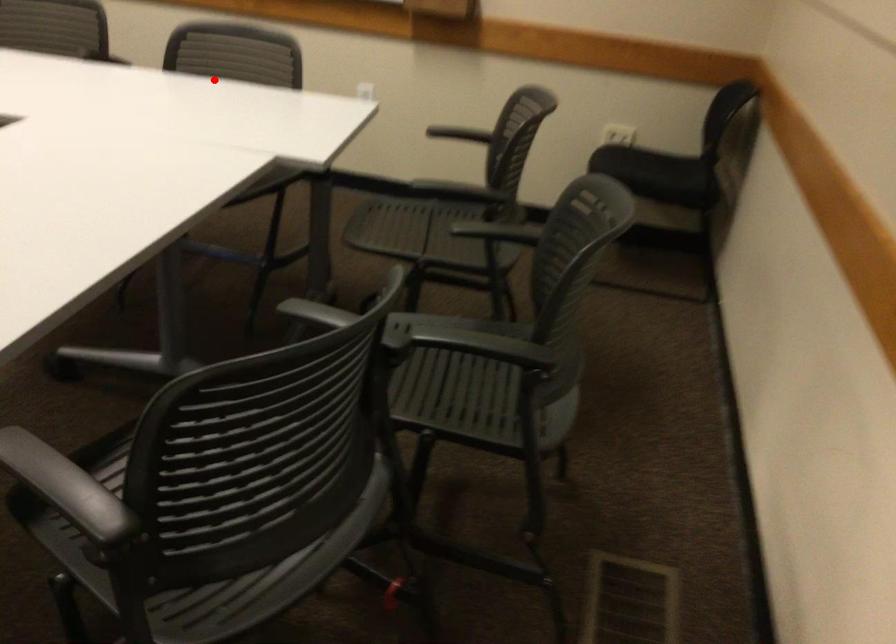
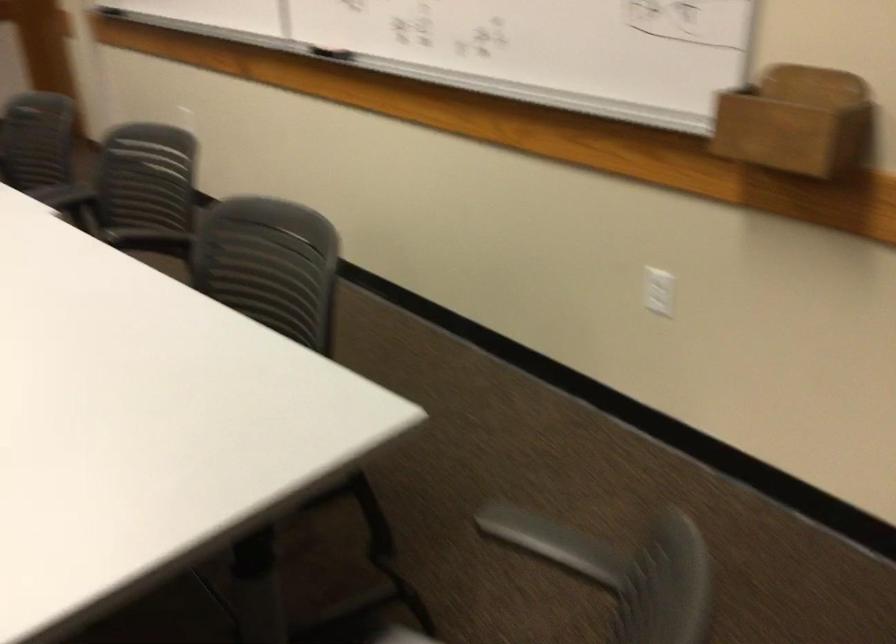
Locate, in the second image, the point that corresponds to the highlighted location in the first image.

(270, 289)